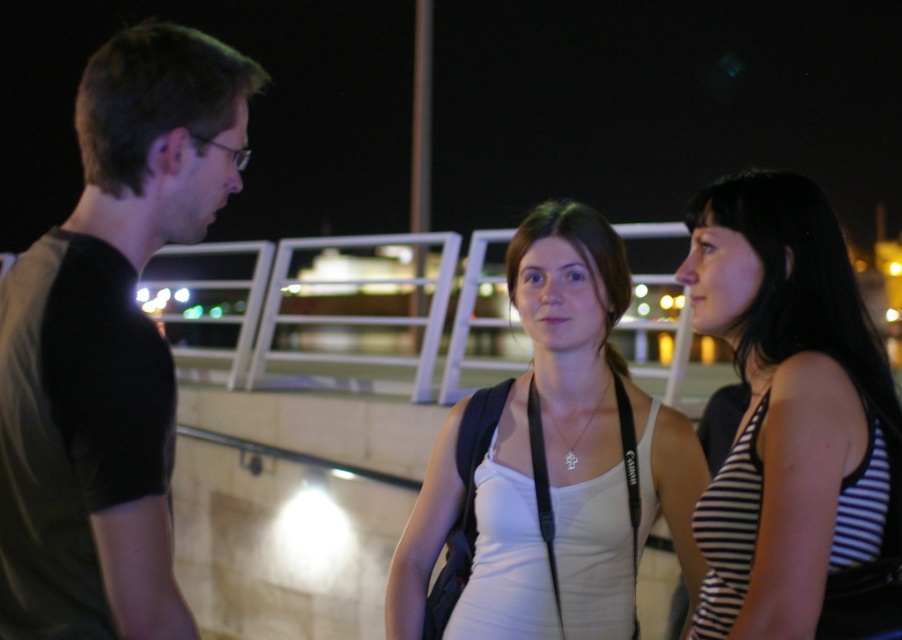
Does dark green t-shirt at left appear under striped fabric tank top at right?

No, dark green t-shirt at left is not below striped fabric tank top at right.

Between dark green t-shirt at left and striped fabric tank top at right, which one has more height?

Standing taller between the two is dark green t-shirt at left.

Measure the distance between dark green t-shirt at left and camera.

dark green t-shirt at left and camera are 6.83 feet apart.

I want to click on dark green t-shirt at left, so click(109, 342).

Can you confirm if dark green t-shirt at left is shorter than white fabric tank top at center?

Correct, dark green t-shirt at left is not as tall as white fabric tank top at center.

Does dark green t-shirt at left have a lesser width compared to white fabric tank top at center?

Correct, dark green t-shirt at left's width is less than white fabric tank top at center's.

Who is more forward, (78, 556) or (577, 627)?

Point (78, 556) is in front.

This screenshot has width=902, height=640. What are the coordinates of `dark green t-shirt at left` in the screenshot? It's located at (109, 342).

Who is higher up, striped fabric tank top at right or white fabric tank top at center?

Positioned higher is striped fabric tank top at right.

Which is more to the right, striped fabric tank top at right or white fabric tank top at center?

Positioned to the right is striped fabric tank top at right.

Locate an element on the screen. striped fabric tank top at right is located at coordinates (793, 420).

Locate an element on the screen. striped fabric tank top at right is located at coordinates (793, 420).